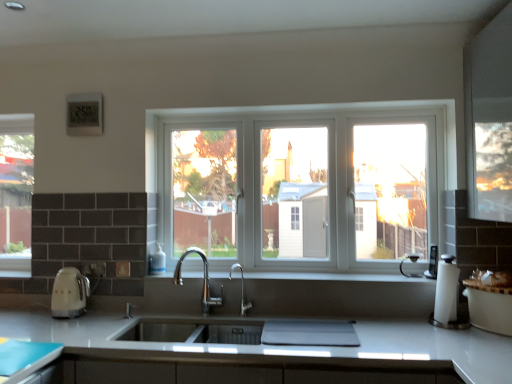
The image size is (512, 384). In order to click on vacant space behind white plastic phone at right, which ranks as the 1th appliance in right-to-left order in this screenshot , I will do `click(421, 271)`.